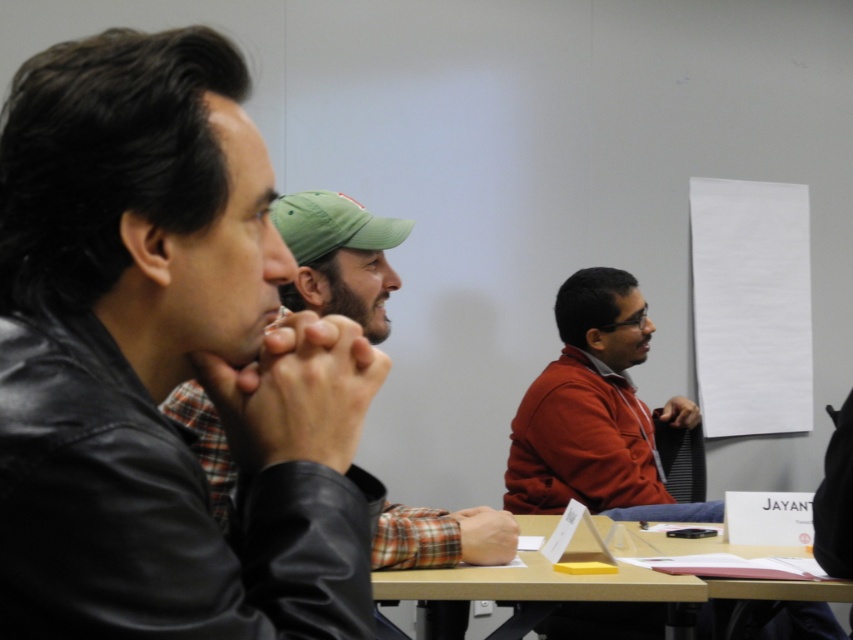
Based on the scene description, where is the leather jacket at center located in terms of coordinates?

The leather jacket at center is located at coordinates point [339,257].

You are a photographer trying to capture a candid shot of the matte red jacket at center without including the leather jacket at left in the frame. Based on their positions, is this possible?

The leather jacket at left is in front of the matte red jacket at center, so it would block the view. Therefore, it is not possible to capture the matte red jacket at center without including the leather jacket at left in the frame.